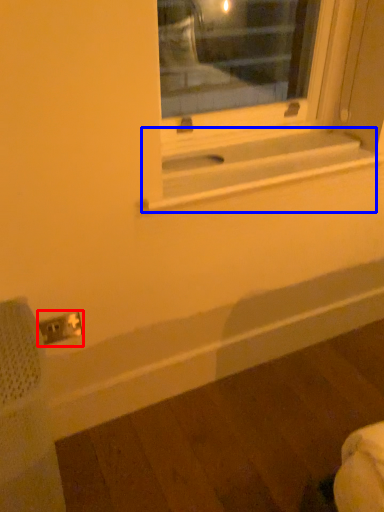
Question: Which point is further to the camera, electric outlet (highlighted by a red box) or window sill (highlighted by a blue box)?

Choices:
 (A) electric outlet
 (B) window sill

Answer: (A)